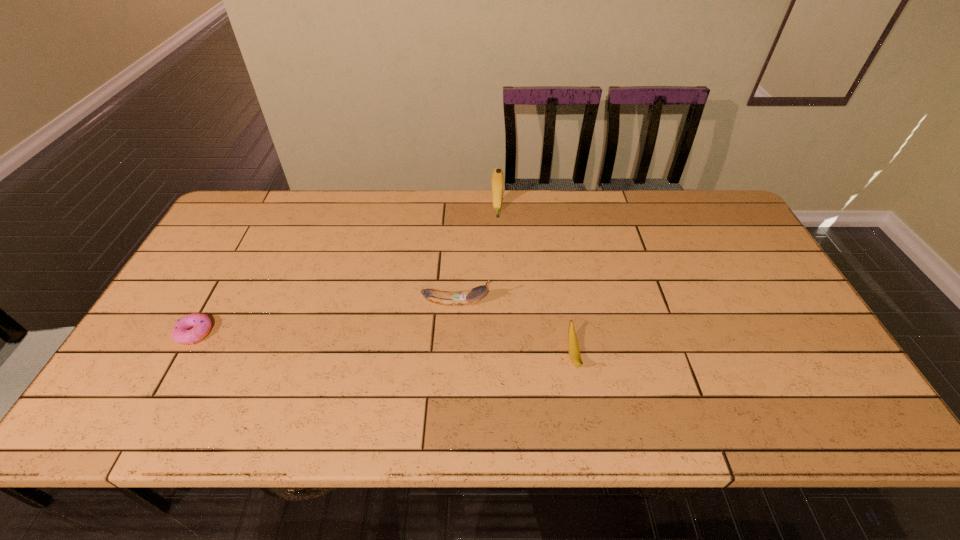
Where is `vacant point located between the shortest banana and the leftmost object`? vacant point located between the shortest banana and the leftmost object is located at coordinates (384, 344).

I want to click on vacant space that is in between the doughnut and the third nearest object, so click(x=325, y=318).

What are the coordinates of `free space that is in between the doughnut and the nearest banana` in the screenshot? It's located at (384, 344).

The height and width of the screenshot is (540, 960). What are the coordinates of `vacant space that's between the farthest object and the second shortest banana` in the screenshot? It's located at (476, 256).

Where is `free space that is in between the leftmost banana and the rightmost banana`? The height and width of the screenshot is (540, 960). free space that is in between the leftmost banana and the rightmost banana is located at coordinates (515, 329).

At what (x,y) coordinates should I click in order to perform the action: click on vacant space that is in between the rightmost banana and the leftmost object. Please return your answer as a coordinate pair (x, y). Looking at the image, I should click on (384, 344).

The width and height of the screenshot is (960, 540). Find the location of `free space between the nearest banana and the shortest object`. free space between the nearest banana and the shortest object is located at coordinates (384, 344).

Where is `empty location between the nearest banana and the doughnut`? empty location between the nearest banana and the doughnut is located at coordinates (384, 344).

You are a GUI agent. You are given a task and a screenshot of the screen. Output one action in this format:
    pyautogui.click(x=<x>, y=<y>)
    Task: Click on the empty location between the farthest banana and the second nearest banana
    
    Given the screenshot: What is the action you would take?
    pyautogui.click(x=476, y=256)

The height and width of the screenshot is (540, 960). Find the location of `vacant point located between the nearest banana and the doughnut`. vacant point located between the nearest banana and the doughnut is located at coordinates (384, 344).